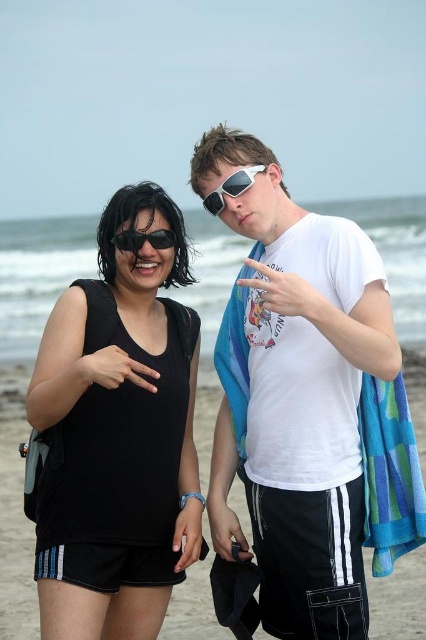
Who is higher up, blue striped towel at lower right or black matte sunglasses at upper left?

black matte sunglasses at upper left is higher up.

Is blue striped towel at lower right below black matte sunglasses at upper left?

Correct, blue striped towel at lower right is located below black matte sunglasses at upper left.

Who is more forward, (371, 492) or (134, 253)?

Point (371, 492) is more forward.

Identify the location of blue striped towel at lower right. (389, 474).

Is white matte t-shirt at center further to camera compared to blue striped towel at lower right?

Yes, white matte t-shirt at center is further from the viewer.

Which is behind, point (221, 419) or point (365, 380)?

The point (221, 419) is behind.

Is point (224, 147) farther from camera compared to point (385, 547)?

Yes, point (224, 147) is farther from viewer.

Find the location of a particular element. The image size is (426, 640). white matte t-shirt at center is located at coordinates (304, 390).

Who is shorter, black matte tank top at left or blue striped towel at lower right?

blue striped towel at lower right

Can you confirm if black matte tank top at left is shorter than blue striped towel at lower right?

In fact, black matte tank top at left may be taller than blue striped towel at lower right.

Does point (164, 424) come closer to viewer compared to point (376, 445)?

No, (164, 424) is further to viewer.

I want to click on black matte tank top at left, so click(x=118, y=435).